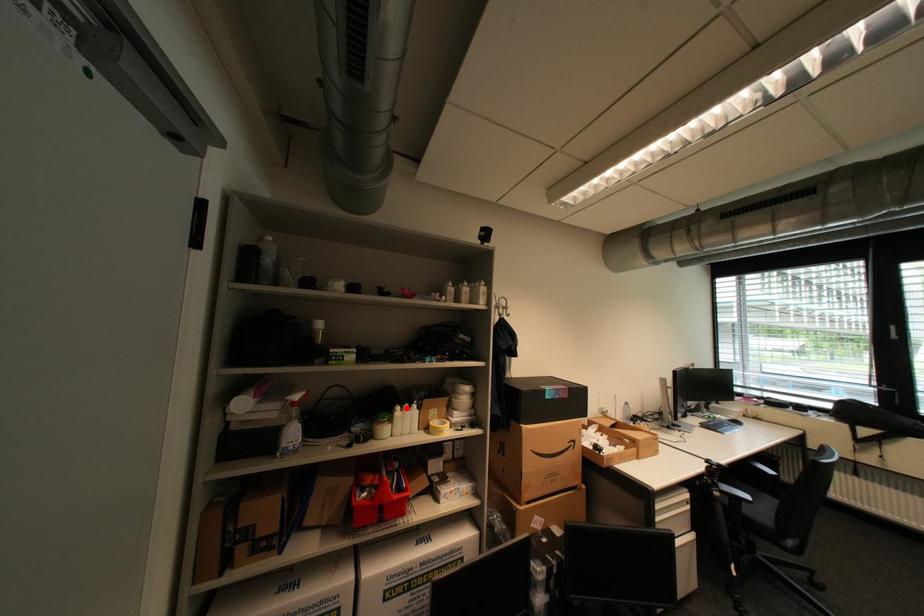
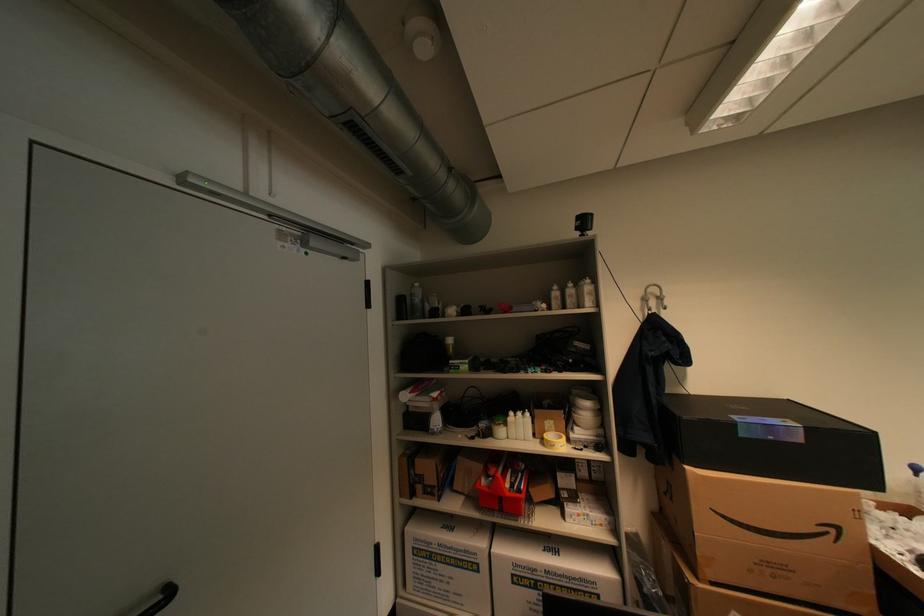
Question: I am providing you with two images of the same scene from different viewpoints. In image1, a red point is highlighted. Considering the same 3D point in image2, which of the following is correct?

Choices:
 (A) It is closer
 (B) It is farther

Answer: (B)